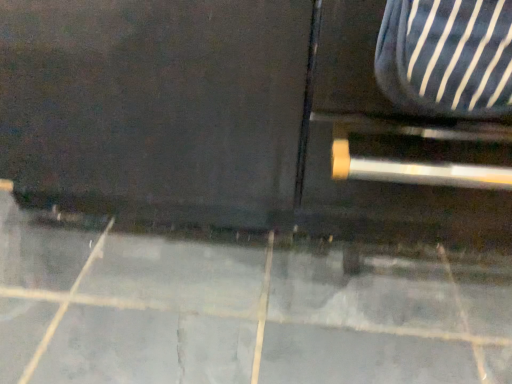
Measure the distance between gray tile floor at lower center and camera.

The distance of gray tile floor at lower center from camera is 22.42 inches.

This screenshot has width=512, height=384. What do you see at coordinates (242, 306) in the screenshot?
I see `gray tile floor at lower center` at bounding box center [242, 306].

The width and height of the screenshot is (512, 384). I want to click on gray tile floor at lower center, so click(x=242, y=306).

What do you see at coordinates (446, 57) in the screenshot?
I see `striped fabric armchair at right` at bounding box center [446, 57].

The image size is (512, 384). Identify the location of striped fabric armchair at right. (446, 57).

Find the location of a particular element. gray tile floor at lower center is located at coordinates (242, 306).

Does striped fabric armchair at right appear on the left side of gray tile floor at lower center?

No.

Is the position of striped fabric armchair at right less distant than that of gray tile floor at lower center?

Yes, it is.

Considering the positions of points (510, 14) and (103, 247), is point (510, 14) farther from camera compared to point (103, 247)?

No, (510, 14) is closer to viewer.

From the image's perspective, is striped fabric armchair at right located above gray tile floor at lower center?

Yes, from the image's perspective, striped fabric armchair at right is on top of gray tile floor at lower center.

From a real-world perspective, which object stands above the other?

striped fabric armchair at right.

Considering the sizes of striped fabric armchair at right and gray tile floor at lower center in the image, is striped fabric armchair at right wider or thinner than gray tile floor at lower center?

Considering their sizes, striped fabric armchair at right looks slimmer than gray tile floor at lower center.

Does striped fabric armchair at right have a greater height compared to gray tile floor at lower center?

Indeed, striped fabric armchair at right has a greater height compared to gray tile floor at lower center.

Looking at this image, does striped fabric armchair at right have a smaller size compared to gray tile floor at lower center?

Yes, striped fabric armchair at right is smaller than gray tile floor at lower center.

Choose the correct answer: Is striped fabric armchair at right inside gray tile floor at lower center or outside it?

striped fabric armchair at right lies outside gray tile floor at lower center.

Is striped fabric armchair at right directly adjacent to gray tile floor at lower center?

There is a gap between striped fabric armchair at right and gray tile floor at lower center.

Is striped fabric armchair at right looking in the opposite direction of gray tile floor at lower center?

No, striped fabric armchair at right is not facing away from gray tile floor at lower center.

How distant is striped fabric armchair at right from gray tile floor at lower center?

A distance of 16.88 inches exists between striped fabric armchair at right and gray tile floor at lower center.

The height and width of the screenshot is (384, 512). What are the coordinates of `concrete behind the striped fabric armchair at right` in the screenshot? It's located at (242, 306).

Looking at this image, considering the relative positions of gray tile floor at lower center and striped fabric armchair at right in the image provided, is gray tile floor at lower center to the left or to the right of striped fabric armchair at right?

In the image, gray tile floor at lower center appears on the left side of striped fabric armchair at right.

Is gray tile floor at lower center in front of striped fabric armchair at right?

No.

Is point (57, 217) closer or farther from the camera than point (455, 1)?

Point (57, 217) appears to be farther away from the viewer than point (455, 1).

From the image's perspective, between gray tile floor at lower center and striped fabric armchair at right, who is located below?

gray tile floor at lower center is shown below in the image.

From a real-world perspective, is gray tile floor at lower center physically below striped fabric armchair at right?

Indeed, from a real-world perspective, gray tile floor at lower center is positioned beneath striped fabric armchair at right.

Looking at this image, is gray tile floor at lower center wider or thinner than striped fabric armchair at right?

gray tile floor at lower center is wider than striped fabric armchair at right.

Considering the sizes of objects gray tile floor at lower center and striped fabric armchair at right in the image provided, who is taller, gray tile floor at lower center or striped fabric armchair at right?

Standing taller between the two is striped fabric armchair at right.

Does gray tile floor at lower center have a larger size compared to striped fabric armchair at right?

Yes.

Would you say gray tile floor at lower center is inside or outside striped fabric armchair at right?

gray tile floor at lower center cannot be found inside striped fabric armchair at right.

Are gray tile floor at lower center and striped fabric armchair at right located far from each other?

No, gray tile floor at lower center is not far away from striped fabric armchair at right.

Is gray tile floor at lower center facing away from striped fabric armchair at right?

No.

How different are the orientations of gray tile floor at lower center and striped fabric armchair at right in degrees?

They differ by 91.1 degrees in their facing directions.

Where is `armchair above the gray tile floor at lower center (from the image's perspective)`? The width and height of the screenshot is (512, 384). armchair above the gray tile floor at lower center (from the image's perspective) is located at coordinates (446, 57).

Locate an element on the screen. This screenshot has width=512, height=384. concrete below the striped fabric armchair at right (from the image's perspective) is located at coordinates click(x=242, y=306).

Where is `concrete lying on the left of striped fabric armchair at right`? concrete lying on the left of striped fabric armchair at right is located at coordinates [x=242, y=306].